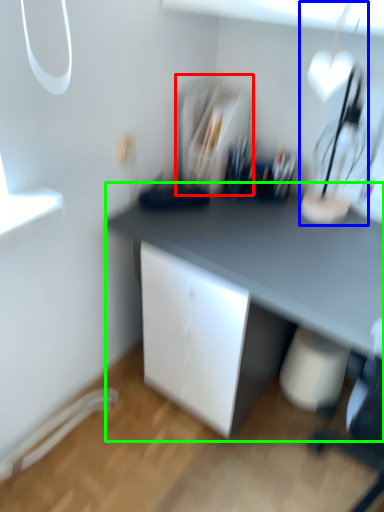
Question: Estimate the real-world distances between objects in this image. Which object is closer to shelf (highlighted by a red box), table lamp (highlighted by a blue box) or desk (highlighted by a green box)?

Choices:
 (A) table lamp
 (B) desk

Answer: (B)